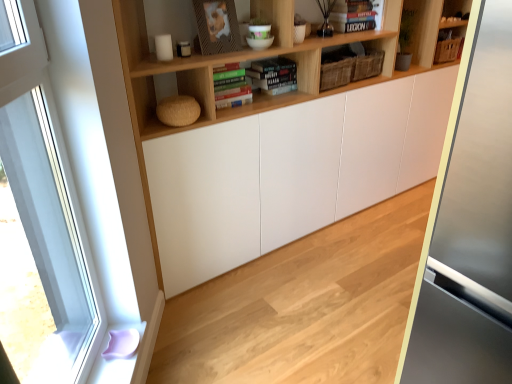
What do you see at coordinates (353, 16) in the screenshot?
I see `hardcover book at upper center, the second book from the bottom` at bounding box center [353, 16].

At what (x,y) coordinates should I click in order to perform the action: click on clear glass window at left. Please return your answer as a coordinate pair (x, y). Looking at the image, I should click on (45, 196).

In order to face wooden shelf at upper center, should I rotate leftwards or rightwards?

You should look right and rotate roughly 2.293 degrees.

The height and width of the screenshot is (384, 512). What do you see at coordinates (263, 56) in the screenshot?
I see `wooden shelf at upper center` at bounding box center [263, 56].

Where is `hardcover book at upper center, marked as the first book in a back-to-front arrangement`? This screenshot has height=384, width=512. hardcover book at upper center, marked as the first book in a back-to-front arrangement is located at coordinates (353, 16).

What's the angular difference between wooden shelf at upper center and natural wood floor at center's facing directions?

The angular difference between wooden shelf at upper center and natural wood floor at center is 179 degrees.

Considering the sizes of objects wooden shelf at upper center and natural wood floor at center in the image provided, who is shorter, wooden shelf at upper center or natural wood floor at center?

With less height is natural wood floor at center.

Based on the photo, is the position of wooden shelf at upper center more distant than that of natural wood floor at center?

That is True.

Between wooden shelf at upper center and natural wood floor at center, which one has larger size?

wooden shelf at upper center is bigger.

How far apart are clear glass window at left and natural wood floor at center?

A distance of 36.80 inches exists between clear glass window at left and natural wood floor at center.

From a real-world perspective, is clear glass window at left on natural wood floor at center?

Yes.

Is clear glass window at left located outside natural wood floor at center?

Yes, clear glass window at left is not within natural wood floor at center.

Considering the positions of points (28, 12) and (390, 382), is point (28, 12) farther from camera compared to point (390, 382)?

That is False.

Could hardcover book at center, positioned as the 2th book in top-to-bottom order, be considered to be inside natural wood floor at center?

No, hardcover book at center, positioned as the 2th book in top-to-bottom order, is located outside of natural wood floor at center.

Is natural wood floor at center aimed at hardcover book at center, which appears as the second book when viewed from the right?

No, natural wood floor at center does not turn towards hardcover book at center, which appears as the second book when viewed from the right.

From the image's perspective, which object appears higher, natural wood floor at center or hardcover book at center, which appears as the 1th book when viewed from the left?

hardcover book at center, which appears as the 1th book when viewed from the left.

From a real-world perspective, which is physically above, natural wood floor at center or hardcover book at center, which appears as the second book when viewed from the right?

In real-world perspective, hardcover book at center, which appears as the second book when viewed from the right, is above.

Which object is closer to the camera, natural wood floor at center or wooden shelf at upper center?

natural wood floor at center.

Is natural wood floor at center next to wooden shelf at upper center?

No, natural wood floor at center is not touching wooden shelf at upper center.

Is point (357, 266) closer or farther from the camera than point (454, 2)?

Point (357, 266) is closer to the camera than point (454, 2).

Which is correct: natural wood floor at center is inside wooden shelf at upper center, or outside of it?

natural wood floor at center is outside wooden shelf at upper center.

Is hardcover book at upper center, arranged as the 2th book when viewed from the left, positioned with its back to natural wood floor at center?

No.

Could you measure the distance between hardcover book at upper center, marked as the first book in a back-to-front arrangement, and natural wood floor at center?

1.49 meters.

Between hardcover book at upper center, placed as the first book when sorted from right to left, and natural wood floor at center, which one is positioned in front?

natural wood floor at center.

Can you confirm if hardcover book at upper center, marked as the first book in a back-to-front arrangement, is taller than natural wood floor at center?

Correct, hardcover book at upper center, marked as the first book in a back-to-front arrangement, is much taller as natural wood floor at center.

Is hardcover book at center, which ranks as the first book in bottom-to-top order, in front of or behind wooden shelf at upper center in the image?

Clearly, hardcover book at center, which ranks as the first book in bottom-to-top order, is behind wooden shelf at upper center.

Consider the image. Could you tell me if hardcover book at center, which ranks as the first book in bottom-to-top order, is facing wooden shelf at upper center?

Yes, hardcover book at center, which ranks as the first book in bottom-to-top order, is turned towards wooden shelf at upper center.

Is point (224, 90) closer or farther from the camera than point (423, 17)?

Point (224, 90).

Is hardcover book at center, the 2th book positioned from the back, shorter than wooden shelf at upper center?

Yes.

From a real-world perspective, is wooden shelf at upper center on top of hardcover book at upper center, placed as the first book when sorted from right to left?

Incorrect, from a real-world perspective, wooden shelf at upper center is lower than hardcover book at upper center, placed as the first book when sorted from right to left.

Looking at this image, from their relative heights in the image, would you say wooden shelf at upper center is taller or shorter than hardcover book at upper center, the second book from the bottom?

wooden shelf at upper center is taller than hardcover book at upper center, the second book from the bottom.

Is wooden shelf at upper center directly adjacent to hardcover book at upper center, which is the 1th book from top to bottom?

No, wooden shelf at upper center is not with hardcover book at upper center, which is the 1th book from top to bottom.

You are a GUI agent. You are given a task and a screenshot of the screen. Output one action in this format:
    pyautogui.click(x=<x>, y=<y>)
    Task: Click on the shelf above the natural wood floor at center (from the image's perspective)
    The height and width of the screenshot is (384, 512).
    Given the screenshot: What is the action you would take?
    pyautogui.click(x=263, y=56)

Where is `window above the natural wood floor at center (from a real-world perspective)`? The width and height of the screenshot is (512, 384). window above the natural wood floor at center (from a real-world perspective) is located at coordinates (45, 196).

Estimate the real-world distances between objects in this image. Which object is further from clear glass window at left, natural wood floor at center or wooden shelf at upper center?

natural wood floor at center is positioned further to the anchor clear glass window at left.

From the image, which object appears to be nearer to natural wood floor at center, hardcover book at upper center, which is the 1th book from top to bottom, or wooden shelf at upper center?

Based on the image, wooden shelf at upper center appears to be nearer to natural wood floor at center.

Which object lies further to the anchor point clear glass window at left, hardcover book at center, positioned as the 1th book in front-to-back order, or natural wood floor at center?

hardcover book at center, positioned as the 1th book in front-to-back order, is positioned further to the anchor clear glass window at left.

Considering their positions, is hardcover book at upper center, marked as the first book in a back-to-front arrangement, positioned closer to hardcover book at center, which ranks as the first book in bottom-to-top order, than clear glass window at left?

hardcover book at upper center, marked as the first book in a back-to-front arrangement.

When comparing their distances from hardcover book at upper center, which is the 1th book from top to bottom, does natural wood floor at center or hardcover book at center, the 2th book positioned from the back, seem further?

Based on the image, natural wood floor at center appears to be further to hardcover book at upper center, which is the 1th book from top to bottom.

When comparing their distances from natural wood floor at center, does clear glass window at left or hardcover book at upper center, placed as the first book when sorted from right to left, seem further?

hardcover book at upper center, placed as the first book when sorted from right to left, is positioned further to the anchor natural wood floor at center.

Which object lies nearer to the anchor point clear glass window at left, natural wood floor at center or hardcover book at upper center, marked as the 2th book in a front-to-back arrangement?

natural wood floor at center.

Considering their positions, is wooden shelf at upper center positioned closer to hardcover book at center, which appears as the 1th book when viewed from the left, than clear glass window at left?

wooden shelf at upper center.

Locate an element on the screen. window between hardcover book at upper center, which is the 1th book from top to bottom, and natural wood floor at center from top to bottom is located at coordinates (45, 196).

Image resolution: width=512 pixels, height=384 pixels. In order to click on book located between wooden shelf at upper center and hardcover book at upper center, which is the 1th book from top to bottom, in the depth direction in this screenshot , I will do `click(231, 86)`.

This screenshot has width=512, height=384. What are the coordinates of `window between wooden shelf at upper center and natural wood floor at center in the vertical direction` in the screenshot? It's located at (45, 196).

Locate an element on the screen. Image resolution: width=512 pixels, height=384 pixels. shelf positioned between clear glass window at left and hardcover book at upper center, marked as the 2th book in a front-to-back arrangement, from near to far is located at coordinates (263, 56).